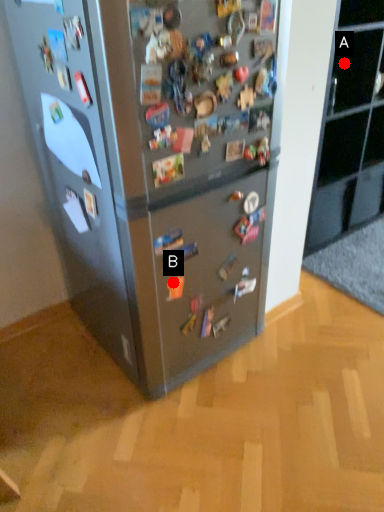
Question: Two points are circled on the image, labeled by A and B beside each circle. Among these points, which one is farthest from the camera?

Choices:
 (A) A is further
 (B) B is further

Answer: (A)